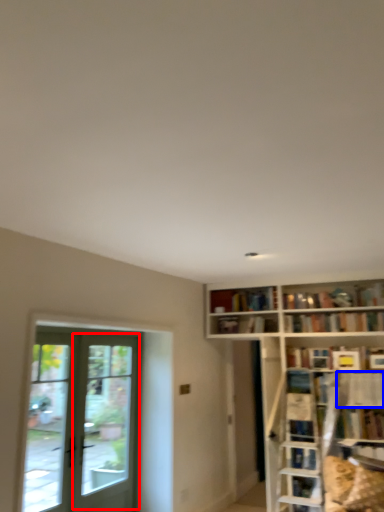
Question: Among these objects, which one is farthest to the camera, screen door (highlighted by a red box) or shelf (highlighted by a blue box)?

Choices:
 (A) screen door
 (B) shelf

Answer: (B)